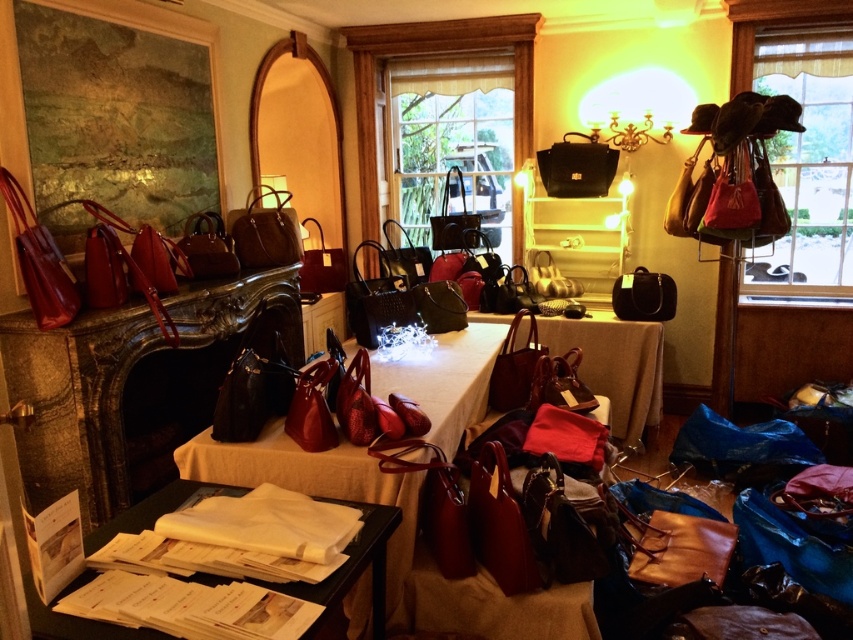
Who is more forward, (4,337) or (53,600)?

Positioned in front is point (53,600).

Between point (213, 349) and point (381, 566), which one is positioned in front?

Positioned in front is point (381, 566).

Locate an element on the screen. This screenshot has height=640, width=853. shiny dark brown fireplace at left is located at coordinates (132, 385).

You are a GUI agent. You are given a task and a screenshot of the screen. Output one action in this format:
    pyautogui.click(x=<x>, y=<y>)
    Task: Click on the shiny leather handbags at center
    The image size is (853, 640).
    Given the screenshot: What is the action you would take?
    pyautogui.click(x=312, y=483)

Does shiny leather handbags at center lie behind white paper at lower left?

That is True.

Which is behind, point (415, 492) or point (328, 628)?

Positioned behind is point (328, 628).

This screenshot has height=640, width=853. Identify the location of shiny leather handbags at center. (312, 483).

Does point (88, 573) lie in front of point (634, 419)?

Yes, it is.

How distant is white paper at lower left from matte leather handbag at center?

white paper at lower left and matte leather handbag at center are 2.27 meters apart from each other.

Between point (352, 545) and point (646, 412), which one is positioned in front?

Point (352, 545) is in front.

You are a GUI agent. You are given a task and a screenshot of the screen. Output one action in this format:
    pyautogui.click(x=<x>, y=<y>)
    Task: Click on the white paper at lower left
    
    Given the screenshot: What is the action you would take?
    pyautogui.click(x=351, y=572)